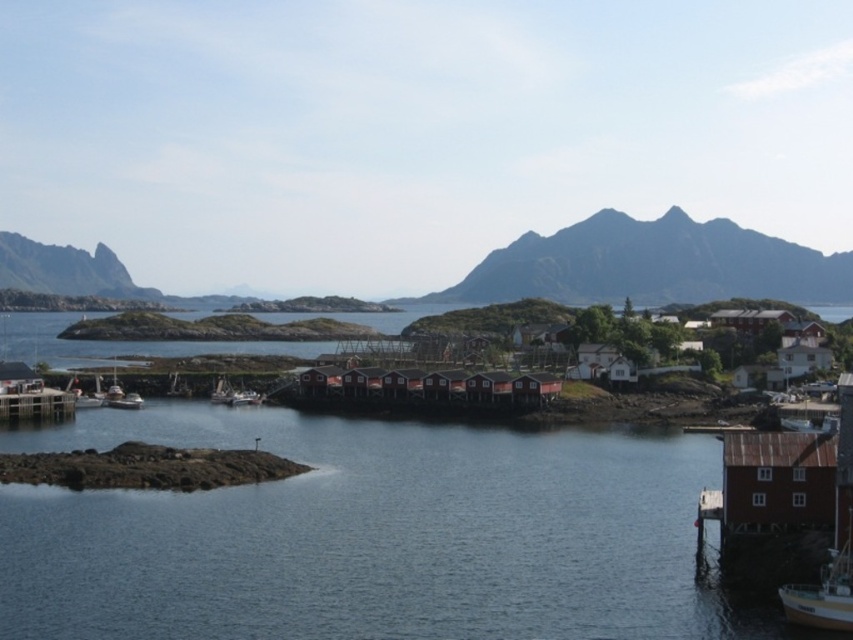
Is point (848, 616) positioned behind point (10, 410)?

No.

Is wooden boat at lower right to the right of wooden dock at lower left from the viewer's perspective?

Indeed, wooden boat at lower right is positioned on the right side of wooden dock at lower left.

Where is `wooden boat at lower right`? The width and height of the screenshot is (853, 640). wooden boat at lower right is located at coordinates (825, 589).

Where is `wooden boat at lower right`? wooden boat at lower right is located at coordinates (825, 589).

Is brown rocky island at lower left bigger than wooden boat at lower right?

Correct, brown rocky island at lower left is larger in size than wooden boat at lower right.

Can you confirm if brown rocky island at lower left is shorter than wooden boat at lower right?

No.

This screenshot has width=853, height=640. I want to click on brown rocky island at lower left, so [x=146, y=467].

Between point (437, 292) and point (79, 404), which one is positioned behind?

Positioned behind is point (437, 292).

Looking at this image, does rugged stone mountain at upper center have a lesser width compared to wooden boat at lower left?

Incorrect, rugged stone mountain at upper center's width is not less than wooden boat at lower left's.

Who is more distant from viewer, (x=775, y=284) or (x=93, y=394)?

Point (x=775, y=284)

The height and width of the screenshot is (640, 853). Identify the location of rugged stone mountain at upper center. (653, 264).